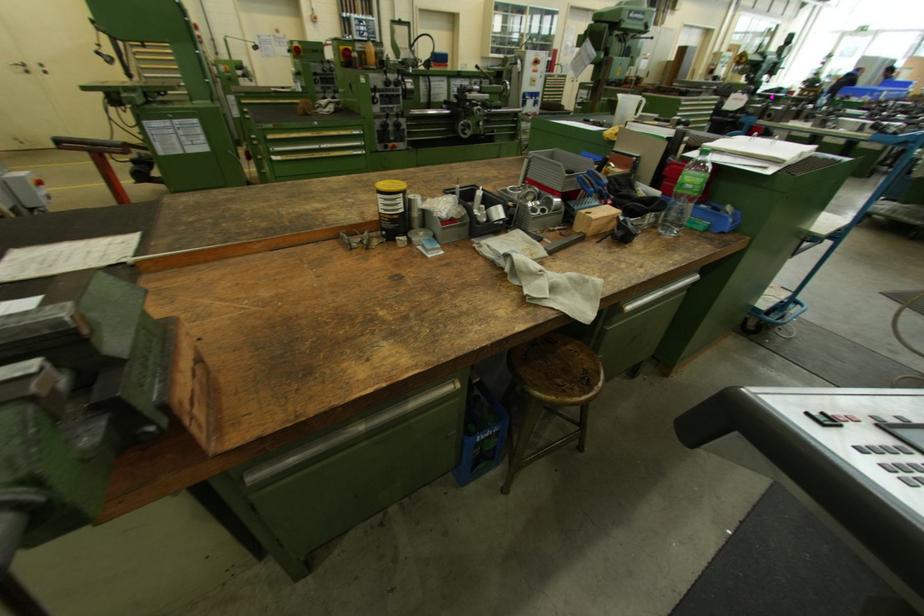
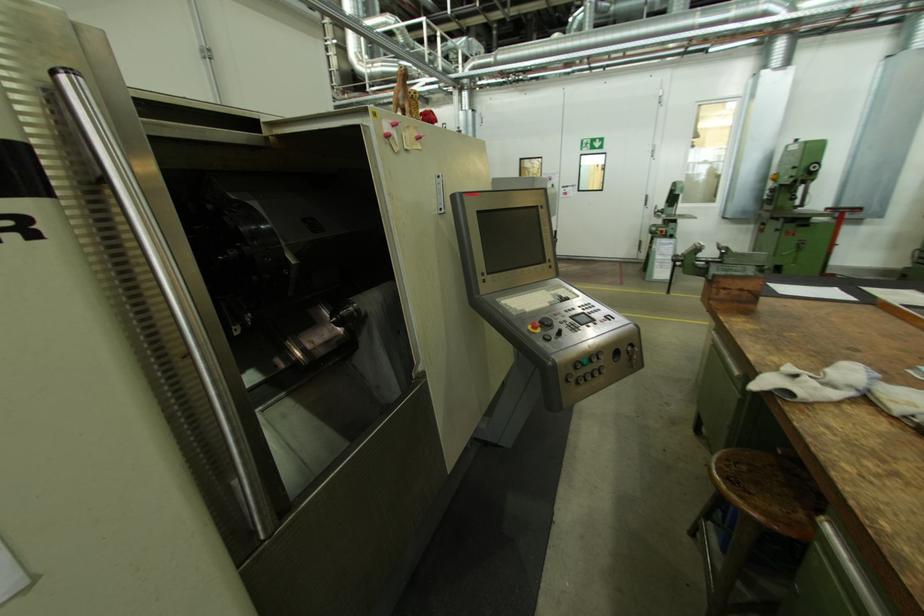
Where in the second image is the point corresponding to [591,371] from the first image?

(755, 493)